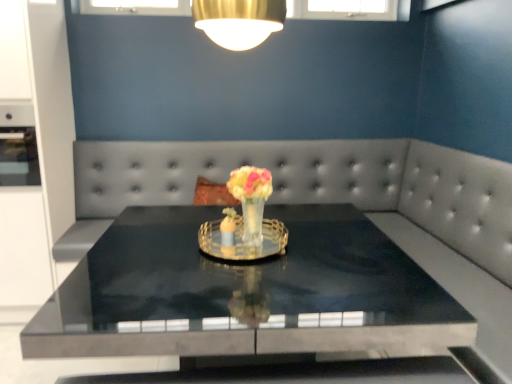
Question: In terms of size, does black polished table at center appear bigger or smaller than translucent glass vase at center?

Choices:
 (A) big
 (B) small

Answer: (A)

Question: Is point (165, 251) positioned closer to the camera than point (249, 218)?

Choices:
 (A) closer
 (B) farther

Answer: (B)

Question: Which object is positioned closest to the satin gray couch at center?

Choices:
 (A) translucent glass vase at center
 (B) black polished table at center

Answer: (B)

Question: Considering the real-world distances, which object is farthest from the translucent glass vase at center?

Choices:
 (A) satin gray couch at center
 (B) black polished table at center

Answer: (A)